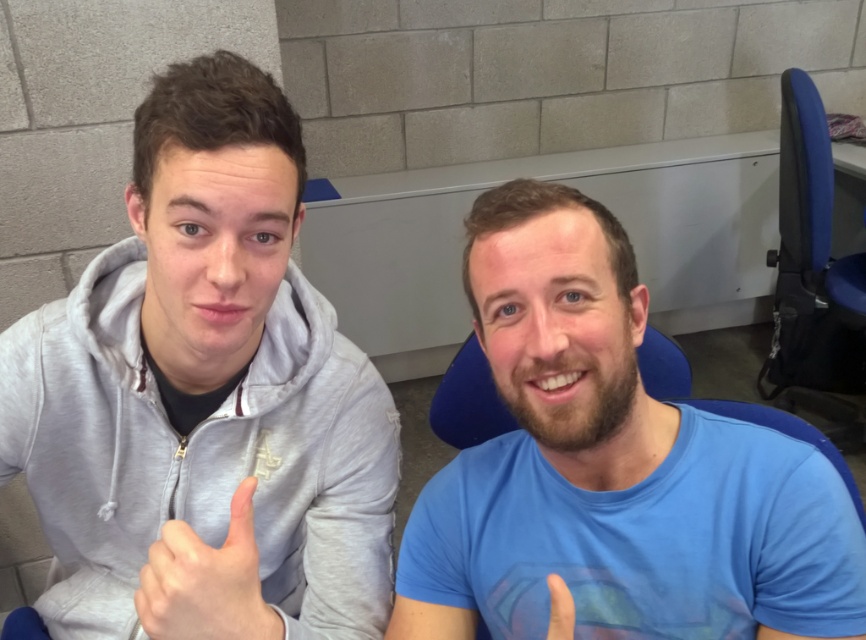
Question: Among these points, which one is farthest from the camera?

Choices:
 (A) (228, 616)
 (B) (559, 624)

Answer: (A)

Question: Observing the image, what is the correct spatial positioning of matte gray hand at center in reference to matte blue finger at center?

Choices:
 (A) right
 (B) left

Answer: (B)

Question: Estimate the real-world distances between objects in this image. Which object is closer to the matte gray hoodie at left?

Choices:
 (A) blue matte shirt at center
 (B) matte gray hand at center
 (C) matte blue finger at center

Answer: (B)

Question: Is matte gray hoodie at left positioned in front of matte blue finger at center?

Choices:
 (A) no
 (B) yes

Answer: (A)

Question: Which point is closer to the camera taking this photo?

Choices:
 (A) (821, 561)
 (B) (260, 611)
 (C) (565, 605)

Answer: (C)

Question: Can you confirm if matte gray hoodie at left is smaller than matte blue finger at center?

Choices:
 (A) no
 (B) yes

Answer: (A)